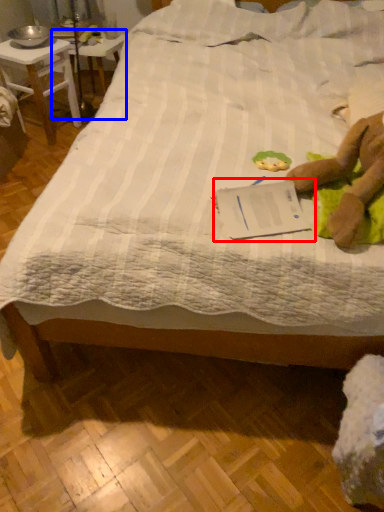
Question: Among these objects, which one is farthest to the camera, paperback book (highlighted by a red box) or table (highlighted by a blue box)?

Choices:
 (A) paperback book
 (B) table

Answer: (B)